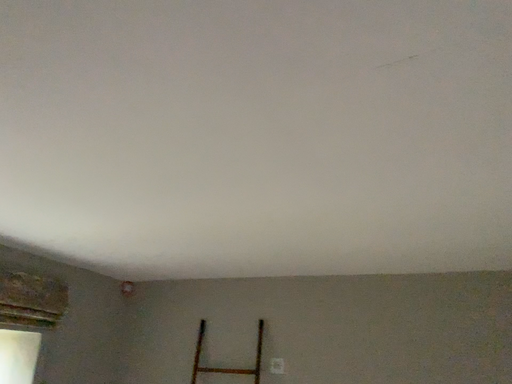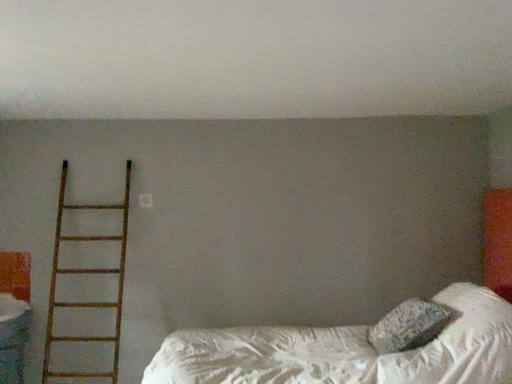
Question: How did the camera likely rotate when shooting the video?

Choices:
 (A) rotated downward
 (B) rotated upward

Answer: (A)